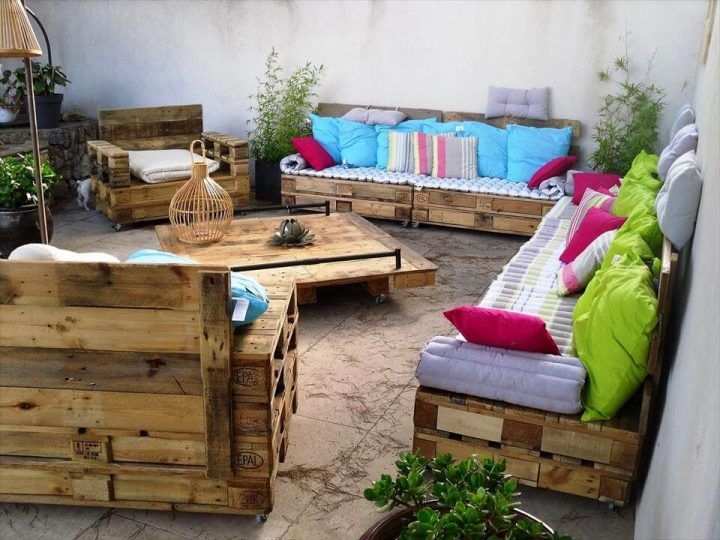
Locate an element on the screen. This screenshot has width=720, height=540. lamp is located at coordinates [24, 36].